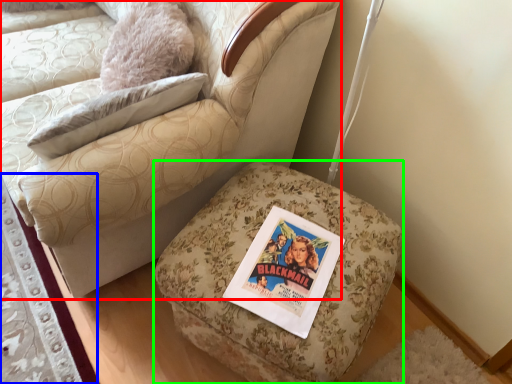
Question: Based on their relative distances, which object is farther from chair (highlighted by a red box)? Choose from mat (highlighted by a blue box) and furniture (highlighted by a green box).

Choices:
 (A) mat
 (B) furniture

Answer: (A)